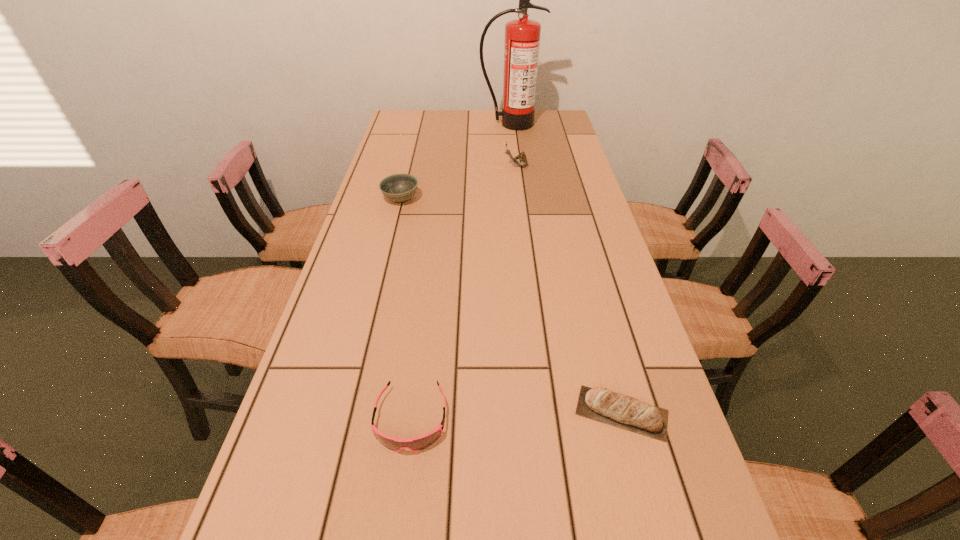
Identify the location of the farthest object. (522, 36).

At what (x,y) coordinates should I click in order to perform the action: click on the tallest object. Please return your answer as a coordinate pair (x, y). The width and height of the screenshot is (960, 540). Looking at the image, I should click on (522, 36).

I want to click on the second farthest object, so click(520, 160).

Locate an element on the screen. the second tallest object is located at coordinates (520, 160).

Identify the location of the third farthest object. This screenshot has height=540, width=960. (x=399, y=188).

Where is `the third tallest object`? This screenshot has height=540, width=960. the third tallest object is located at coordinates (399, 188).

The width and height of the screenshot is (960, 540). I want to click on goggles, so pyautogui.click(x=418, y=443).

This screenshot has height=540, width=960. What are the coordinates of `pita bread` in the screenshot? It's located at (601, 404).

Image resolution: width=960 pixels, height=540 pixels. In order to click on vacant space situated on the front-facing side of the fire extinguisher in this screenshot , I will do `click(516, 165)`.

This screenshot has width=960, height=540. I want to click on vacant space located 0.120m on the face of the fourth nearest object, so click(x=470, y=166).